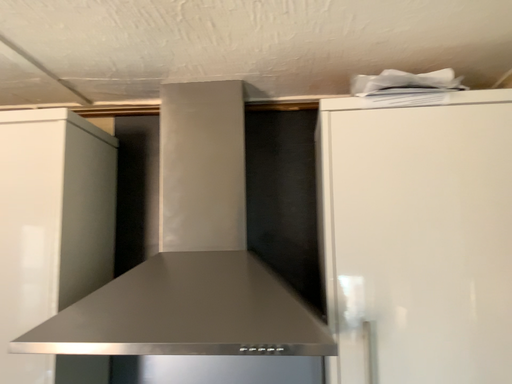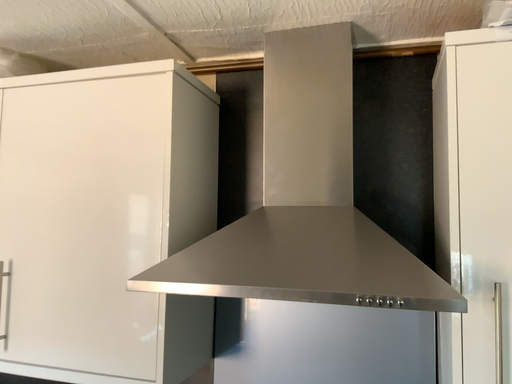
Question: How did the camera likely rotate when shooting the video?

Choices:
 (A) rotated left
 (B) rotated right

Answer: (A)